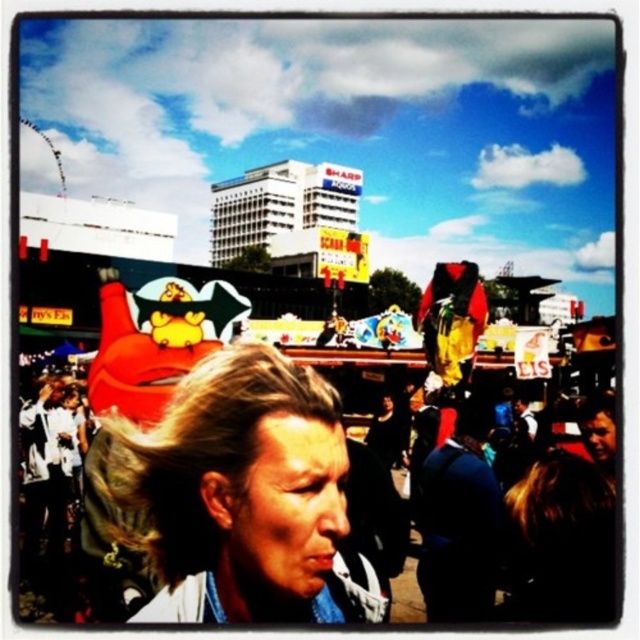
You are a photographer trying to capture a clear shot of the blue fabric jacket at center and the blonde hair at center. Based on their sizes, which object should you focus on first to ensure it is in sharp focus?

The blonde hair at center has a smaller size compared to the blue fabric jacket at center. To ensure both are in focus, prioritize focusing on the smaller object first, which is the blonde hair at center, as smaller details require precise focus.

You are a photographer trying to capture the entire white fabric at center and blonde hair at center in one shot. Based on their widths, which object should you focus on to ensure both fit in the frame?

The white fabric at center is wider than the blonde hair at center, so focusing on the wider white fabric at center will ensure both objects fit in the frame.

You are standing at the point with coordinates point [433,483] and want to walk towards the point with coordinates point [176,541]. Will you be moving towards the foreground or background?

Since point [176,541] is in front of point [433,483], moving towards it means you are moving towards the foreground.